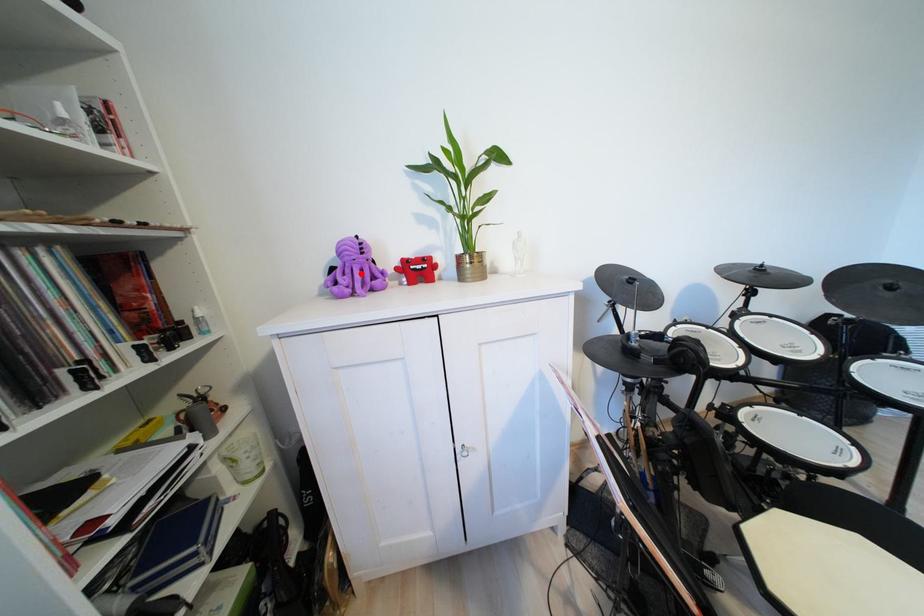
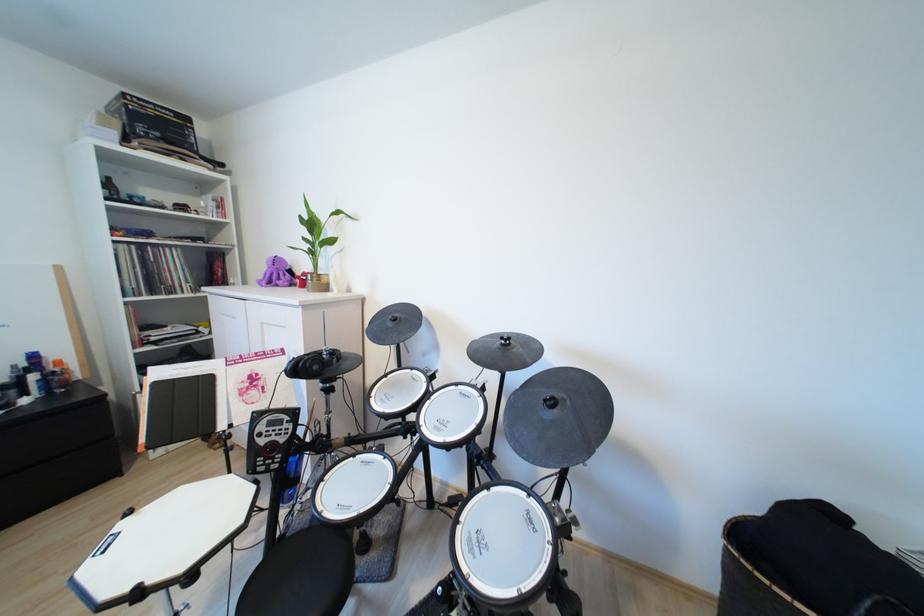
The point at the highlighted location is marked in the first image. Where is the corresponding point in the second image?

(289, 277)